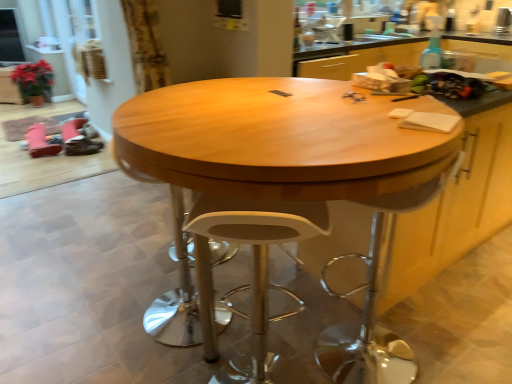
You are a GUI agent. You are given a task and a screenshot of the screen. Output one action in this format:
    pyautogui.click(x=<x>, y=<y>)
    Task: Click on the free spot behind white plastic swivel chair at center
    
    Given the screenshot: What is the action you would take?
    pyautogui.click(x=351, y=306)